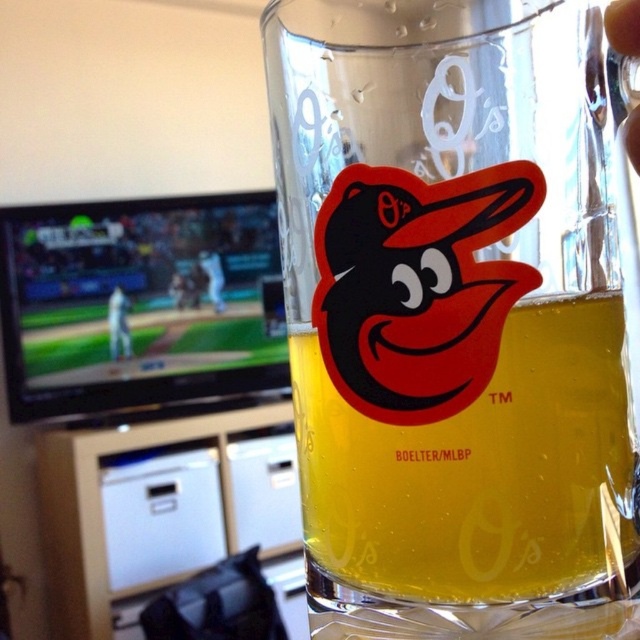
You are holding a clear glass beer mug at center and need to place a sticker exactly at point (456, 316) on it. Where should you place the sticker on the mug?

The point (456, 316) is on the clear glass beer mug at center, so you should place the sticker on the mug itself.

You are at a baseball game and holding the clear glass beer mug at center. You want to pour the translucent glass beer at center into it. Is the beer already in the mug?

The clear glass beer mug at center is above the translucent glass beer at center, so the beer is not yet in the mug.

You are at a sports bar and see the clear glass beer mug at center and the translucent glass beer at center. Which one is closer to you?

The clear glass beer mug at center is closer to you because it is in front of the translucent glass beer at center.